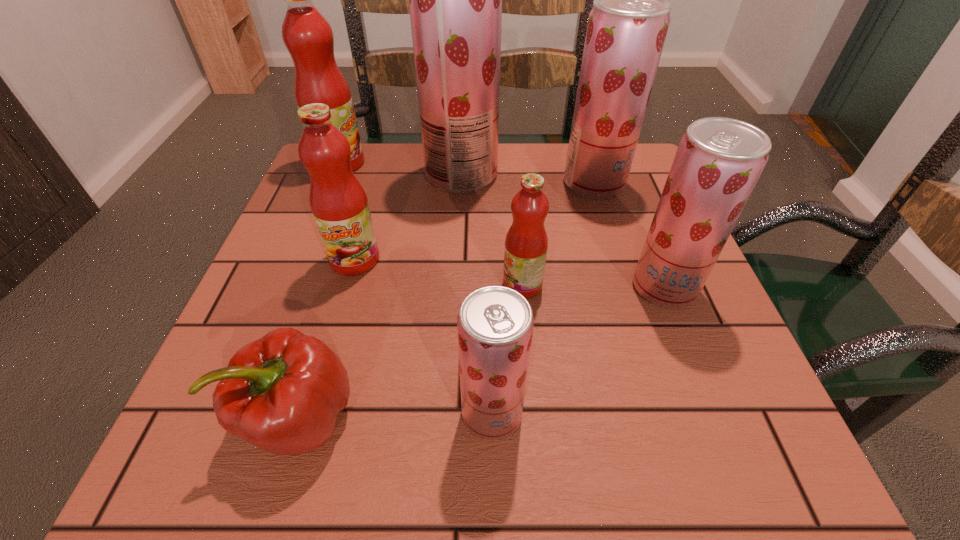
Where is `pepper`? This screenshot has height=540, width=960. pepper is located at coordinates (283, 392).

Find the location of a particular element. free location located 0.130m on the front of the tallest fruit juice is located at coordinates (458, 233).

Identify the location of vacant point located on the front label of the farthest pink fruit juice. The width and height of the screenshot is (960, 540). (515, 163).

Where is `vacant space situated 0.190m on the front of the second biggest strawberry fruit juice`? This screenshot has width=960, height=540. vacant space situated 0.190m on the front of the second biggest strawberry fruit juice is located at coordinates (618, 261).

Find the location of a particular element. This screenshot has width=960, height=540. blank space located on the front label of the second smallest pink fruit juice is located at coordinates (322, 376).

Image resolution: width=960 pixels, height=540 pixels. I want to click on free space located on the left of the third biggest strawberry fruit juice, so point(461,287).

Find the location of a particular element. vacant space situated 0.140m on the left of the nearest fruit juice is located at coordinates (364, 413).

Locate an element on the screen. The height and width of the screenshot is (540, 960). vacant region located on the front label of the smallest pink fruit juice is located at coordinates (420, 285).

This screenshot has width=960, height=540. What are the coordinates of `blank space located 0.140m on the front label of the smallest pink fruit juice` in the screenshot? It's located at (425, 285).

At what (x,y) coordinates should I click in order to perform the action: click on vacant space positioned 0.370m on the front label of the smallest pink fruit juice. Please return your answer as a coordinate pair (x, y). Looking at the image, I should click on (299, 285).